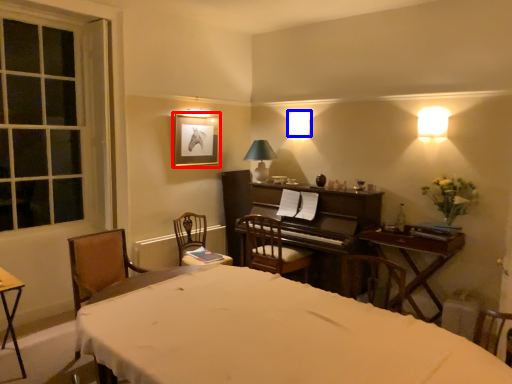
Question: Which object appears closest to the camera in this image, picture frame (highlighted by a red box) or lamp (highlighted by a blue box)?

Choices:
 (A) picture frame
 (B) lamp

Answer: (A)